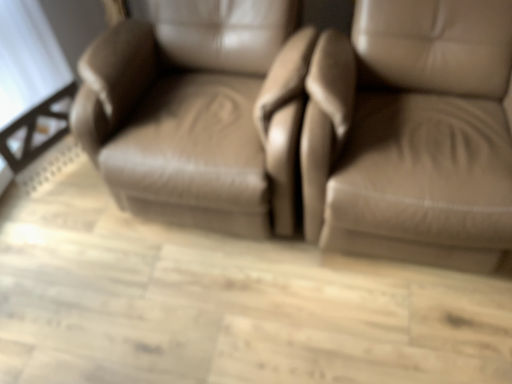
This screenshot has height=384, width=512. I want to click on matte leather chair at center, positioned as the first chair in left-to-right order, so click(199, 112).

This screenshot has width=512, height=384. Describe the element at coordinates (199, 112) in the screenshot. I see `matte leather chair at center, the second chair when ordered from right to left` at that location.

Image resolution: width=512 pixels, height=384 pixels. What do you see at coordinates (412, 134) in the screenshot?
I see `matte leather chair at right, which is the 2th chair in left-to-right order` at bounding box center [412, 134].

The height and width of the screenshot is (384, 512). Find the location of `matte leather chair at right, placed as the first chair when sorted from right to left`. matte leather chair at right, placed as the first chair when sorted from right to left is located at coordinates (412, 134).

Locate an element on the screen. matte leather chair at center, positioned as the first chair in left-to-right order is located at coordinates (199, 112).

Visually, is matte leather chair at right, which is the 2th chair in left-to-right order, positioned to the left or to the right of matte leather chair at center, positioned as the first chair in left-to-right order?

matte leather chair at right, which is the 2th chair in left-to-right order, is to the right of matte leather chair at center, positioned as the first chair in left-to-right order.

Does matte leather chair at right, placed as the first chair when sorted from right to left, lie in front of matte leather chair at center, the second chair when ordered from right to left?

That is True.

Between point (357, 162) and point (257, 73), which one is positioned behind?

The point (257, 73) is behind.

From the image's perspective, which is below, matte leather chair at right, placed as the first chair when sorted from right to left, or matte leather chair at center, positioned as the first chair in left-to-right order?

matte leather chair at right, placed as the first chair when sorted from right to left.

Looking at this image, from a real-world perspective, which object stands above the other?

matte leather chair at right, placed as the first chair when sorted from right to left, from a real-world perspective.

Considering the sizes of objects matte leather chair at right, placed as the first chair when sorted from right to left, and matte leather chair at center, positioned as the first chair in left-to-right order, in the image provided, who is wider, matte leather chair at right, placed as the first chair when sorted from right to left, or matte leather chair at center, positioned as the first chair in left-to-right order,?

matte leather chair at right, placed as the first chair when sorted from right to left, is wider.

Who is taller, matte leather chair at right, placed as the first chair when sorted from right to left, or matte leather chair at center, positioned as the first chair in left-to-right order?

matte leather chair at right, placed as the first chair when sorted from right to left, is taller.

Can you confirm if matte leather chair at right, which is the 2th chair in left-to-right order, is smaller than matte leather chair at center, positioned as the first chair in left-to-right order?

Actually, matte leather chair at right, which is the 2th chair in left-to-right order, might be larger than matte leather chair at center, positioned as the first chair in left-to-right order.

Is matte leather chair at right, placed as the first chair when sorted from right to left, not inside matte leather chair at center, the second chair when ordered from right to left?

Indeed, matte leather chair at right, placed as the first chair when sorted from right to left, is completely outside matte leather chair at center, the second chair when ordered from right to left.

Consider the image. Is matte leather chair at right, which is the 2th chair in left-to-right order, far away from matte leather chair at center, positioned as the first chair in left-to-right order?

They are positioned close to each other.

Is matte leather chair at right, which is the 2th chair in left-to-right order, aimed at matte leather chair at center, positioned as the first chair in left-to-right order?

No, matte leather chair at right, which is the 2th chair in left-to-right order, does not turn towards matte leather chair at center, positioned as the first chair in left-to-right order.

The image size is (512, 384). Find the location of `chair below the matte leather chair at center, the second chair when ordered from right to left (from the image's perspective)`. chair below the matte leather chair at center, the second chair when ordered from right to left (from the image's perspective) is located at coordinates (412, 134).

From the picture: Based on their positions, is matte leather chair at center, positioned as the first chair in left-to-right order, located to the left or right of matte leather chair at right, placed as the first chair when sorted from right to left?

Clearly, matte leather chair at center, positioned as the first chair in left-to-right order, is on the left of matte leather chair at right, placed as the first chair when sorted from right to left, in the image.

Which object is more forward, matte leather chair at center, positioned as the first chair in left-to-right order, or matte leather chair at right, which is the 2th chair in left-to-right order?

matte leather chair at right, which is the 2th chair in left-to-right order, is more forward.

Considering the points (212, 34) and (362, 146), which point is behind, point (212, 34) or point (362, 146)?

Point (212, 34)

From the image's perspective, which object appears higher, matte leather chair at center, the second chair when ordered from right to left, or matte leather chair at right, placed as the first chair when sorted from right to left?

matte leather chair at center, the second chair when ordered from right to left, from the image's perspective.

From a real-world perspective, who is located higher, matte leather chair at center, positioned as the first chair in left-to-right order, or matte leather chair at right, which is the 2th chair in left-to-right order?

matte leather chair at right, which is the 2th chair in left-to-right order, is physically above.

Considering the relative sizes of matte leather chair at center, the second chair when ordered from right to left, and matte leather chair at right, which is the 2th chair in left-to-right order, in the image provided, is matte leather chair at center, the second chair when ordered from right to left, thinner than matte leather chair at right, which is the 2th chair in left-to-right order,?

Yes.

Does matte leather chair at center, the second chair when ordered from right to left, have a greater height compared to matte leather chair at right, which is the 2th chair in left-to-right order?

No, matte leather chair at center, the second chair when ordered from right to left, is not taller than matte leather chair at right, which is the 2th chair in left-to-right order.

Considering the sizes of matte leather chair at center, positioned as the first chair in left-to-right order, and matte leather chair at right, placed as the first chair when sorted from right to left, in the image, is matte leather chair at center, positioned as the first chair in left-to-right order, bigger or smaller than matte leather chair at right, placed as the first chair when sorted from right to left,?

In the image, matte leather chair at center, positioned as the first chair in left-to-right order, appears to be smaller than matte leather chair at right, placed as the first chair when sorted from right to left.

Do you think matte leather chair at center, positioned as the first chair in left-to-right order, is within matte leather chair at right, placed as the first chair when sorted from right to left, or outside of it?

matte leather chair at center, positioned as the first chair in left-to-right order, is spatially situated outside matte leather chair at right, placed as the first chair when sorted from right to left.

Is matte leather chair at center, positioned as the first chair in left-to-right order, next to matte leather chair at right, which is the 2th chair in left-to-right order, and touching it?

No, matte leather chair at center, positioned as the first chair in left-to-right order, is not in contact with matte leather chair at right, which is the 2th chair in left-to-right order.

Is matte leather chair at center, positioned as the first chair in left-to-right order, aimed at matte leather chair at right, which is the 2th chair in left-to-right order?

No, matte leather chair at center, positioned as the first chair in left-to-right order, is not aimed at matte leather chair at right, which is the 2th chair in left-to-right order.

Can you tell me how much matte leather chair at center, the second chair when ordered from right to left, and matte leather chair at right, which is the 2th chair in left-to-right order, differ in facing direction?

The facing directions of matte leather chair at center, the second chair when ordered from right to left, and matte leather chair at right, which is the 2th chair in left-to-right order, are 0.00018 degrees apart.

You are a GUI agent. You are given a task and a screenshot of the screen. Output one action in this format:
    pyautogui.click(x=<x>, y=<y>)
    Task: Click on the chair in front of the matte leather chair at center, positioned as the first chair in left-to-right order
    The height and width of the screenshot is (384, 512).
    Given the screenshot: What is the action you would take?
    pyautogui.click(x=412, y=134)

Find the location of `chair located on the left of matte leather chair at right, which is the 2th chair in left-to-right order`. chair located on the left of matte leather chair at right, which is the 2th chair in left-to-right order is located at coordinates (199, 112).

The image size is (512, 384). Find the location of `chair that appears below the matte leather chair at right, which is the 2th chair in left-to-right order (from a real-world perspective)`. chair that appears below the matte leather chair at right, which is the 2th chair in left-to-right order (from a real-world perspective) is located at coordinates (199, 112).